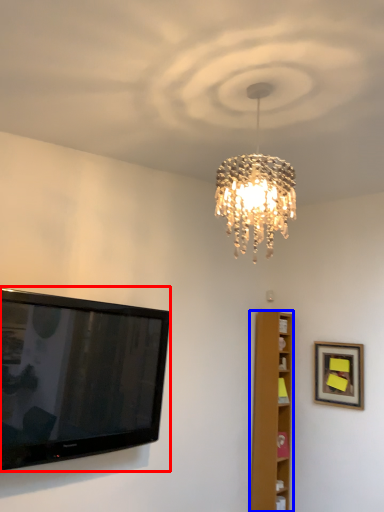
Question: Which point is further to the camera, television (highlighted by a red box) or furniture (highlighted by a blue box)?

Choices:
 (A) television
 (B) furniture

Answer: (B)